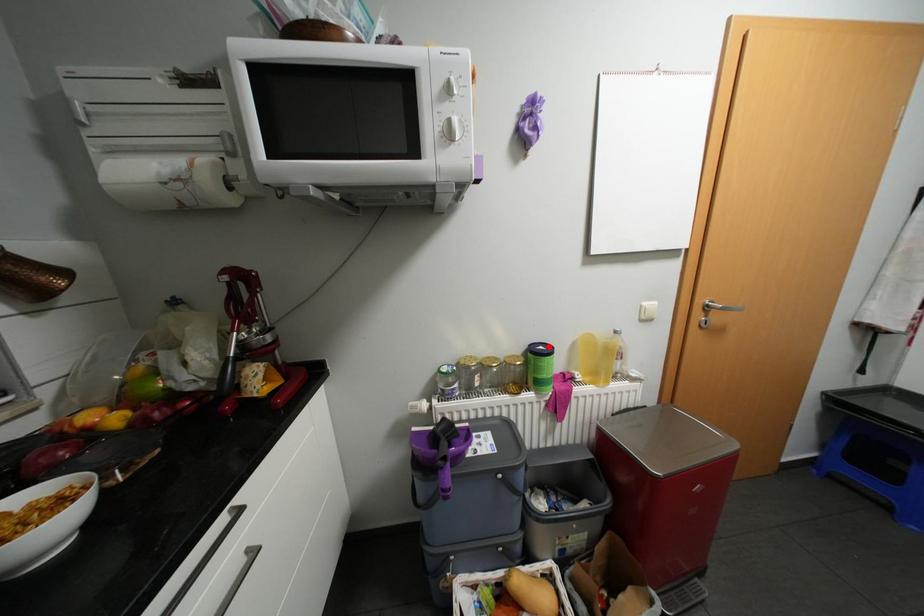
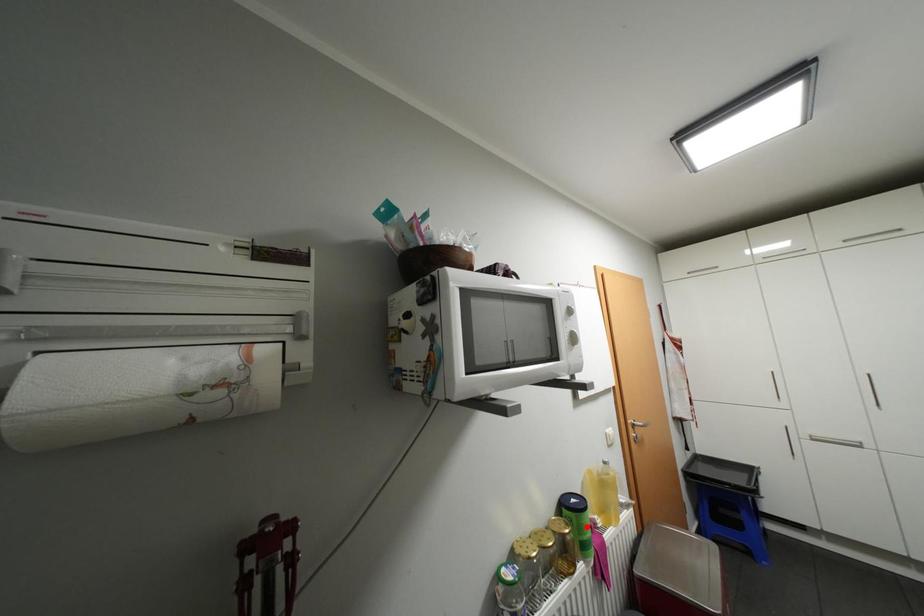
I am providing you with two images of the same scene from different viewpoints. A red point is marked on the first image and another point is marked on the second image. Do the highlighted points in image1 and image2 indicate the same real-world spot?

No